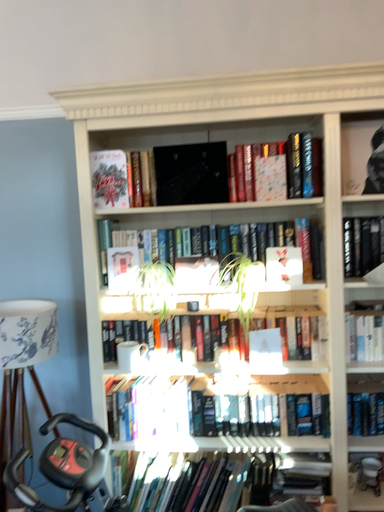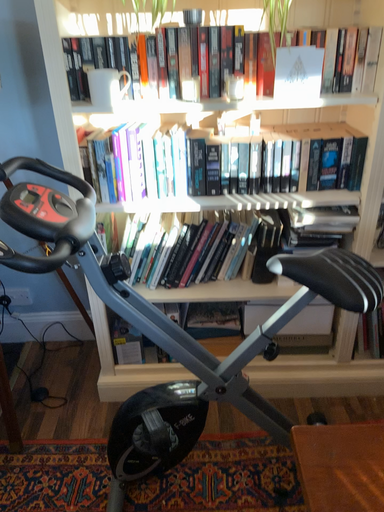
Question: Which way did the camera rotate in the video?

Choices:
 (A) rotated left
 (B) rotated right

Answer: (B)